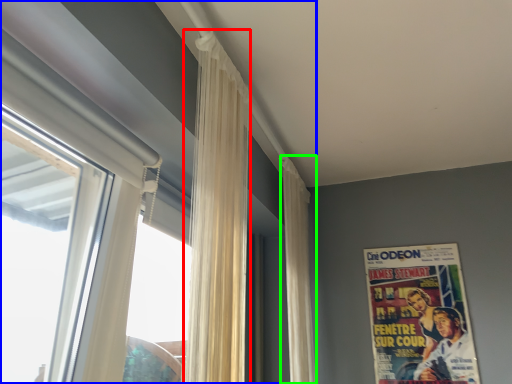
Question: Estimate the real-world distances between objects in this image. Which object is closer to curtain (highlighted by a red box), window (highlighted by a blue box) or curtain (highlighted by a green box)?

Choices:
 (A) window
 (B) curtain

Answer: (A)